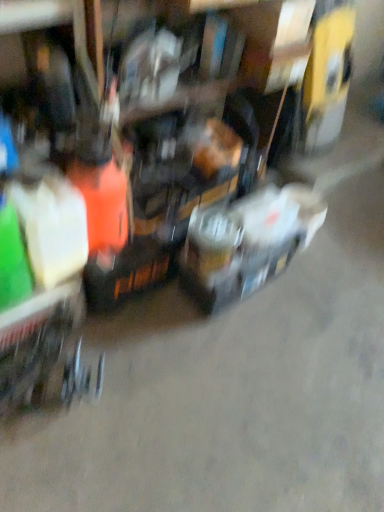
Looking at this image, what is the approximate width of metallic silver trolley at lower left?

13.05 inches.

Locate an element on the screen. The width and height of the screenshot is (384, 512). metallic silver trolley at lower left is located at coordinates pyautogui.click(x=45, y=352).

This screenshot has height=512, width=384. What do you see at coordinates (45, 352) in the screenshot? I see `metallic silver trolley at lower left` at bounding box center [45, 352].

In order to face metallic silver trolley at lower left, should I rotate leftwards or rightwards?

Turn left approximately 19.215 degrees to face it.

Where is `metallic silver toolbox at center`? The width and height of the screenshot is (384, 512). metallic silver toolbox at center is located at coordinates (247, 242).

What do you see at coordinates (247, 242) in the screenshot? I see `metallic silver toolbox at center` at bounding box center [247, 242].

Find the location of `metallic silver trolley at lower left`. metallic silver trolley at lower left is located at coordinates (45, 352).

Which is more to the left, metallic silver trolley at lower left or metallic silver toolbox at center?

From the viewer's perspective, metallic silver trolley at lower left appears more on the left side.

Is the depth of metallic silver trolley at lower left greater than that of metallic silver toolbox at center?

No, metallic silver trolley at lower left is closer to the viewer.

Is point (12, 356) positioned behind point (263, 196)?

No, (12, 356) is closer to viewer.

From the image's perspective, relative to metallic silver toolbox at center, is metallic silver trolley at lower left above or below?

metallic silver trolley at lower left is below metallic silver toolbox at center.

From the picture: From a real-world perspective, is metallic silver trolley at lower left physically located above or below metallic silver toolbox at center?

metallic silver trolley at lower left is below metallic silver toolbox at center.

In terms of width, does metallic silver trolley at lower left look wider or thinner when compared to metallic silver toolbox at center?

Considering their sizes, metallic silver trolley at lower left looks broader than metallic silver toolbox at center.

Is metallic silver trolley at lower left taller or shorter than metallic silver toolbox at center?

Considering their sizes, metallic silver trolley at lower left has less height than metallic silver toolbox at center.

Can you confirm if metallic silver trolley at lower left is smaller than metallic silver toolbox at center?

Yes.

Looking at this image, do you think metallic silver trolley at lower left is within metallic silver toolbox at center, or outside of it?

metallic silver trolley at lower left is spatially situated outside metallic silver toolbox at center.

Is metallic silver trolley at lower left beside metallic silver toolbox at center?

No, metallic silver trolley at lower left is not next to metallic silver toolbox at center.

Looking at this image, could you tell me if metallic silver trolley at lower left is turned towards metallic silver toolbox at center?

No, metallic silver trolley at lower left is not facing towards metallic silver toolbox at center.

How distant is metallic silver trolley at lower left from metallic silver toolbox at center?

A distance of 24.20 inches exists between metallic silver trolley at lower left and metallic silver toolbox at center.

Where is `trolley that is on the left side of metallic silver toolbox at center`? The image size is (384, 512). trolley that is on the left side of metallic silver toolbox at center is located at coordinates (45, 352).

Which object is positioned more to the right, metallic silver toolbox at center or metallic silver trolley at lower left?

metallic silver toolbox at center.

Is the position of metallic silver toolbox at center less distant than that of metallic silver trolley at lower left?

No, it is behind metallic silver trolley at lower left.

Is point (192, 224) in front of point (27, 371)?

No, (192, 224) is behind (27, 371).

From the image's perspective, would you say metallic silver toolbox at center is positioned over metallic silver trolley at lower left?

Indeed, from the image's perspective, metallic silver toolbox at center is shown above metallic silver trolley at lower left.

From a real-world perspective, is metallic silver toolbox at center physically above metallic silver trolley at lower left?

Yes, from a real-world perspective, metallic silver toolbox at center is over metallic silver trolley at lower left

Looking at their sizes, would you say metallic silver toolbox at center is wider or thinner than metallic silver trolley at lower left?

In the image, metallic silver toolbox at center appears to be more narrow than metallic silver trolley at lower left.

Does metallic silver toolbox at center have a lesser height compared to metallic silver trolley at lower left?

Incorrect, the height of metallic silver toolbox at center does not fall short of that of metallic silver trolley at lower left.

Is metallic silver toolbox at center bigger or smaller than metallic silver trolley at lower left?

metallic silver toolbox at center is bigger than metallic silver trolley at lower left.

Is metallic silver toolbox at center not within metallic silver trolley at lower left?

Indeed, metallic silver toolbox at center is completely outside metallic silver trolley at lower left.

From the picture: Are metallic silver toolbox at center and metallic silver trolley at lower left far apart?

No, metallic silver toolbox at center is in close proximity to metallic silver trolley at lower left.

Could you tell me if metallic silver toolbox at center is turned towards metallic silver trolley at lower left?

No, metallic silver toolbox at center is not turned towards metallic silver trolley at lower left.

Find the location of a particular element. trolley below the metallic silver toolbox at center (from a real-world perspective) is located at coordinates (45, 352).

Locate an element on the screen. vehicle that is above the metallic silver trolley at lower left (from the image's perspective) is located at coordinates (247, 242).

You are a GUI agent. You are given a task and a screenshot of the screen. Output one action in this format:
    pyautogui.click(x=<x>, y=<y>)
    Task: Click on the trolley that is in front of the metallic silver toolbox at center
    
    Given the screenshot: What is the action you would take?
    pyautogui.click(x=45, y=352)